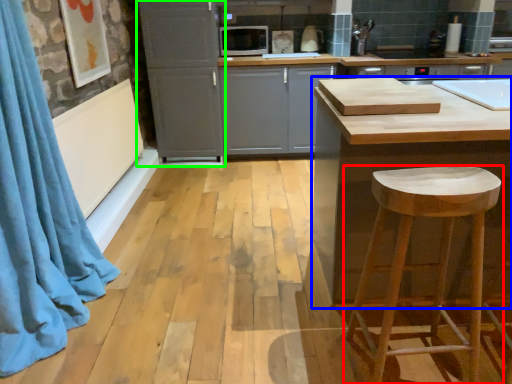
Question: Estimate the real-world distances between objects in this image. Which object is farther from stool (highlighted by a red box), countertop (highlighted by a blue box) or cabinetry (highlighted by a green box)?

Choices:
 (A) countertop
 (B) cabinetry

Answer: (B)